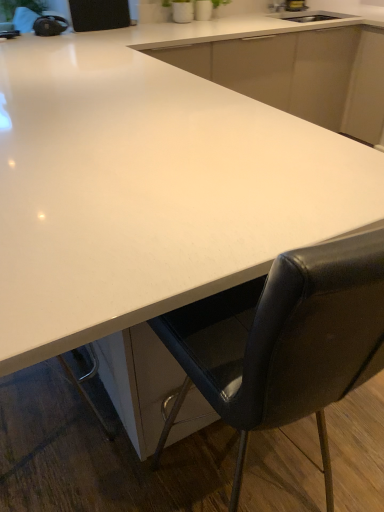
Question: Is point (208, 400) positioned closer to the camera than point (294, 61)?

Choices:
 (A) farther
 (B) closer

Answer: (B)

Question: Is black leather chair at lower right taller or shorter than white glossy countertop at center?

Choices:
 (A) short
 (B) tall

Answer: (B)

Question: Based on their relative distances, which object is nearer to the white glossy countertop at center?

Choices:
 (A) black leather chair at lower right
 (B) white glossy countertop at center

Answer: (A)

Question: Based on their relative distances, which object is farther from the white glossy countertop at center?

Choices:
 (A) black leather chair at lower right
 (B) white glossy countertop at center

Answer: (A)